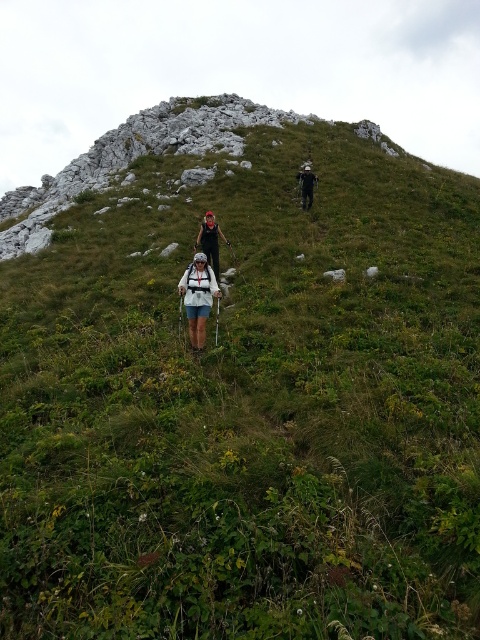
Question: Which of the following is the farthest from the observer?

Choices:
 (A) dark gray fabric backpack at upper center
 (B) white matte backpack at center

Answer: (A)

Question: Which point is closer to the camera?

Choices:
 (A) white matte backpack at center
 (B) dark gray fabric backpack at upper center
 (C) black fabric backpack at center

Answer: (A)

Question: Among these points, which one is nearest to the camera?

Choices:
 (A) (214, 236)
 (B) (313, 173)
 (C) (193, 280)

Answer: (C)

Question: From the image, what is the correct spatial relationship of white matte backpack at center in relation to black fabric backpack at center?

Choices:
 (A) right
 (B) left

Answer: (B)

Question: From the image, what is the correct spatial relationship of white matte backpack at center in relation to dark gray fabric backpack at upper center?

Choices:
 (A) right
 (B) left

Answer: (B)

Question: Can you confirm if black fabric backpack at center is bigger than dark gray fabric backpack at upper center?

Choices:
 (A) no
 (B) yes

Answer: (A)